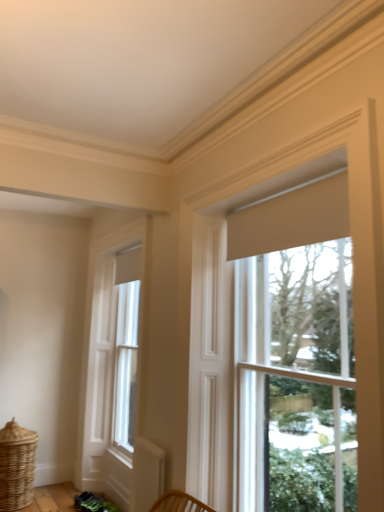
Question: Should I look upward or downward to see beige fabric curtain at upper center?

Choices:
 (A) down
 (B) up

Answer: (B)

Question: Is matte cream roller shade at right, which is the 1th window from right to left, surrounding beige fabric curtain at upper center?

Choices:
 (A) no
 (B) yes

Answer: (A)

Question: From the image's perspective, is matte cream roller shade at right, which is the 1th window from right to left, above beige fabric curtain at upper center?

Choices:
 (A) yes
 (B) no

Answer: (B)

Question: From the image's perspective, does matte cream roller shade at right, the 2th window viewed from the left, appear lower than beige fabric curtain at upper center?

Choices:
 (A) no
 (B) yes

Answer: (B)

Question: Considering the relative sizes of matte cream roller shade at right, which appears as the first window when viewed from the front, and beige fabric curtain at upper center in the image provided, is matte cream roller shade at right, which appears as the first window when viewed from the front, smaller than beige fabric curtain at upper center?

Choices:
 (A) yes
 (B) no

Answer: (B)

Question: Would you say matte cream roller shade at right, which ranks as the 2th window in back-to-front order, is outside beige fabric curtain at upper center?

Choices:
 (A) no
 (B) yes

Answer: (B)

Question: Does matte cream roller shade at right, the 2th window viewed from the left, have a greater height compared to beige fabric curtain at upper center?

Choices:
 (A) no
 (B) yes

Answer: (B)

Question: From a real-world perspective, is beige fabric curtain at upper center positioned under white wood window at left, which is the 2th window in front-to-back order, based on gravity?

Choices:
 (A) no
 (B) yes

Answer: (A)

Question: From the image's perspective, is beige fabric curtain at upper center beneath white wood window at left, which appears as the 1th window when viewed from the left?

Choices:
 (A) no
 (B) yes

Answer: (A)

Question: Is beige fabric curtain at upper center far away from white wood window at left, marked as the 1th window in a back-to-front arrangement?

Choices:
 (A) yes
 (B) no

Answer: (A)

Question: Does beige fabric curtain at upper center have a greater width compared to white wood window at left, positioned as the 2th window in right-to-left order?

Choices:
 (A) no
 (B) yes

Answer: (A)

Question: Is beige fabric curtain at upper center taller than white wood window at left, marked as the 1th window in a back-to-front arrangement?

Choices:
 (A) yes
 (B) no

Answer: (B)

Question: Considering the relative sizes of beige fabric curtain at upper center and white wood window at left, marked as the 1th window in a back-to-front arrangement, in the image provided, is beige fabric curtain at upper center thinner than white wood window at left, marked as the 1th window in a back-to-front arrangement,?

Choices:
 (A) yes
 (B) no

Answer: (A)

Question: Is white wood window at left, which appears as the 1th window when viewed from the left, bigger than woven natural basket at lower left?

Choices:
 (A) no
 (B) yes

Answer: (B)